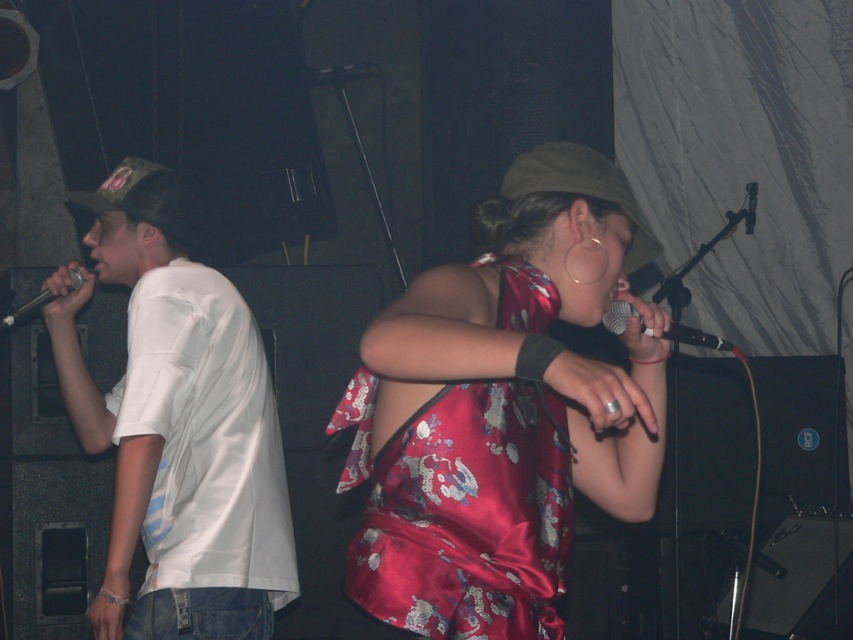
You are a sound technician setting up for a live performance. You notice two microphones on stage. The first is the black matte microphone at center, and the second is the matte black microphone at left. Which microphone is positioned further to the right from your perspective?

The black matte microphone at center is positioned further to the right than the matte black microphone at left.

You are a photographer at the back of the venue. You want to take a photo of the satin dress at center and the matte black microphone at left. Which object will appear larger in your photo?

The satin dress at center appears larger in the photo because it is taller than the matte black microphone at left.

You are a sound technician in a live performance venue. You need to adjust the height of the black matte microphone at center and the matte black microphone at left to ensure both are at the same level for the performers. According to the description, which microphone needs to be raised or lowered?

The black matte microphone at center is not as tall as the matte black microphone at left, so the black matte microphone at center needs to be raised to match the height of the matte black microphone at left.